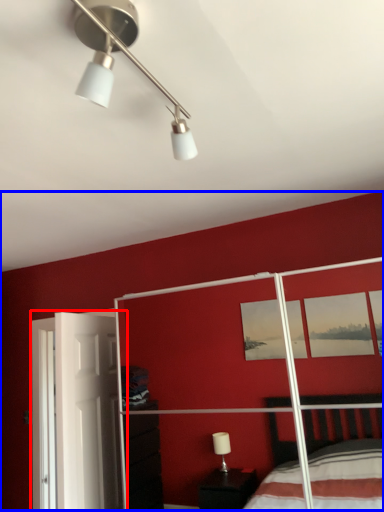
Question: Which object is closer to the camera taking this photo, screen door (highlighted by a red box) or backdrop (highlighted by a blue box)?

Choices:
 (A) screen door
 (B) backdrop

Answer: (B)